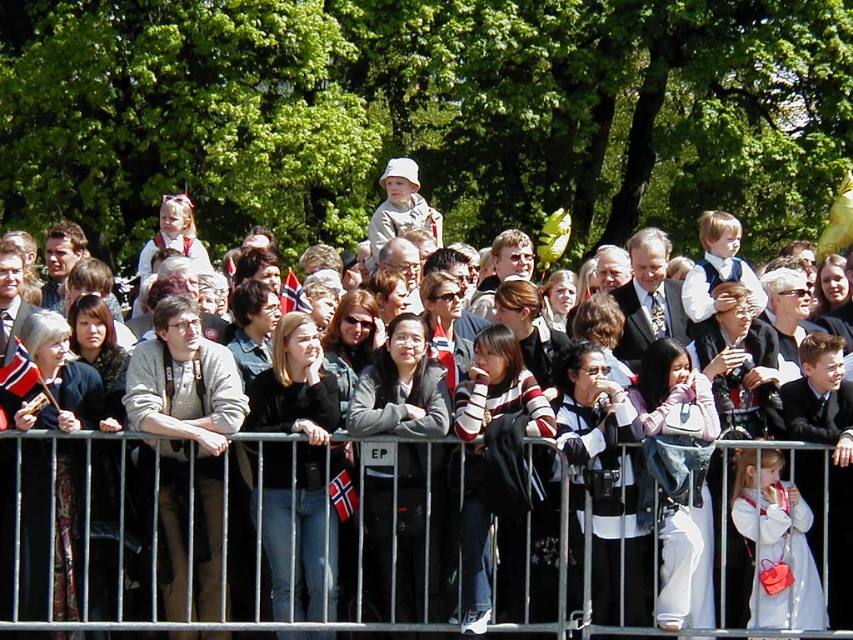
Question: Based on their relative distances, which object is nearer to the black leather jacket at center?

Choices:
 (A) dark gray jacket at center
 (B) light brown sweater at center
 (C) metallic silver fence at center

Answer: (A)

Question: Among these points, which one is nearest to the camera?

Choices:
 (A) (215, 586)
 (B) (171, 314)

Answer: (A)

Question: Is matte black jacket at center thinner than dark gray jacket at center?

Choices:
 (A) yes
 (B) no

Answer: (B)

Question: Does light brown sweater at center lie in front of metallic silver fence at center?

Choices:
 (A) no
 (B) yes

Answer: (A)

Question: Which point appears closest to the camera in this image?

Choices:
 (A) [392, 321]
 (B) [788, 488]

Answer: (B)

Question: Does light blue fabric dress at center have a smaller size compared to metallic silver fence at center?

Choices:
 (A) no
 (B) yes

Answer: (B)